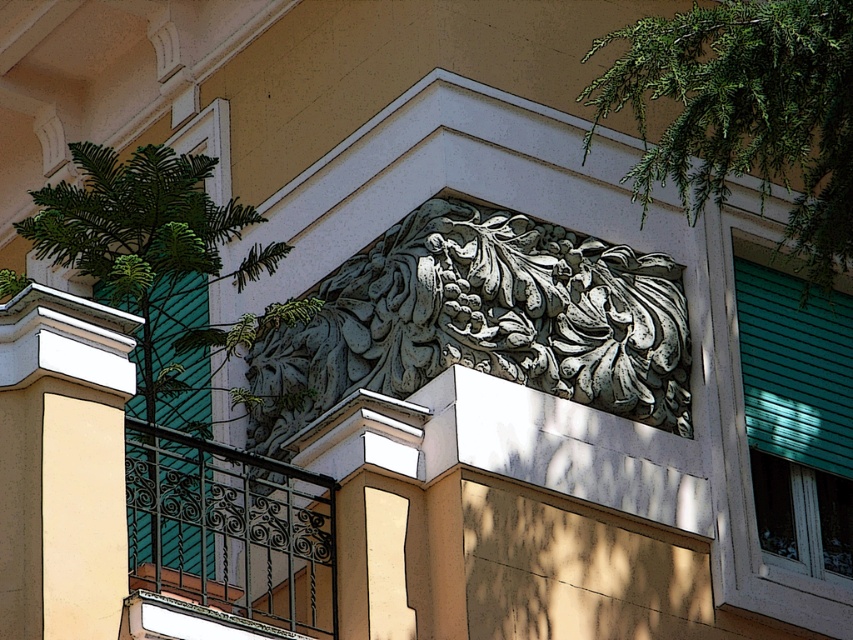
Question: Is white smooth pillar at left positioned before green leafy tree at upper left?

Choices:
 (A) yes
 (B) no

Answer: (A)

Question: In this image, where is green patina stone carving at center located relative to black wrought iron balcony at lower left?

Choices:
 (A) left
 (B) right

Answer: (B)

Question: Which point is farther from the camera taking this photo?

Choices:
 (A) (614, 38)
 (B) (74, 244)
 (C) (42, 320)

Answer: (A)

Question: Which object is the farthest from the black wrought iron balcony at lower left?

Choices:
 (A) green patina stone carving at center
 (B) green leafy tree at upper left
 (C) green leafy branch at upper right
 (D) white smooth pillar at left

Answer: (C)

Question: Which point is closer to the camera?

Choices:
 (A) green leafy tree at upper left
 (B) black wrought iron balcony at lower left
 (C) white smooth pillar at left

Answer: (B)

Question: Does green leafy branch at upper right appear on the right side of green leafy tree at upper left?

Choices:
 (A) yes
 (B) no

Answer: (A)